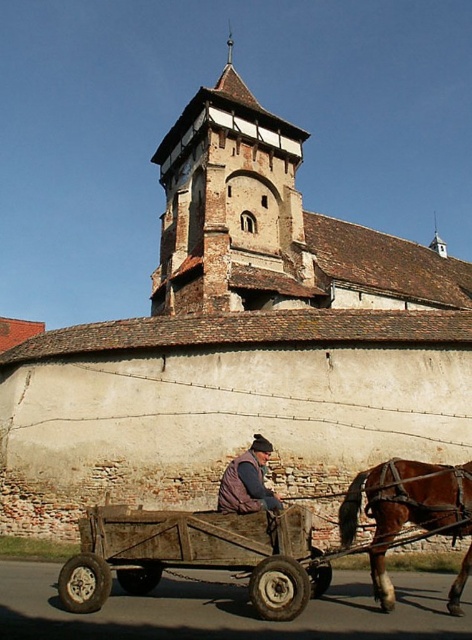
Which is above, brown stone tower at upper center or brown glossy horse at lower right?

brown stone tower at upper center

Is point (217, 160) less distant than point (379, 538)?

No, it is not.

Is point (221, 202) behind point (399, 486)?

Yes.

Locate an element on the screen. brown stone tower at upper center is located at coordinates (230, 205).

Find the location of a particular element. brown stone tower at upper center is located at coordinates (230, 205).

From the picture: Between brown stone tower at upper center and dark brown leather jacket at center, which one is positioned higher?

brown stone tower at upper center

Describe the element at coordinates (230, 205) in the screenshot. Image resolution: width=472 pixels, height=640 pixels. I see `brown stone tower at upper center` at that location.

Locate an element on the screen. brown stone tower at upper center is located at coordinates (230, 205).

Is wooden wagon at center to the right of dark brown leather jacket at center from the viewer's perspective?

In fact, wooden wagon at center is to the left of dark brown leather jacket at center.

Identify the location of wooden wagon at center. Image resolution: width=472 pixels, height=640 pixels. (194, 556).

What do you see at coordinates (194, 556) in the screenshot? I see `wooden wagon at center` at bounding box center [194, 556].

The image size is (472, 640). Find the location of `wooden wagon at center`. wooden wagon at center is located at coordinates (194, 556).